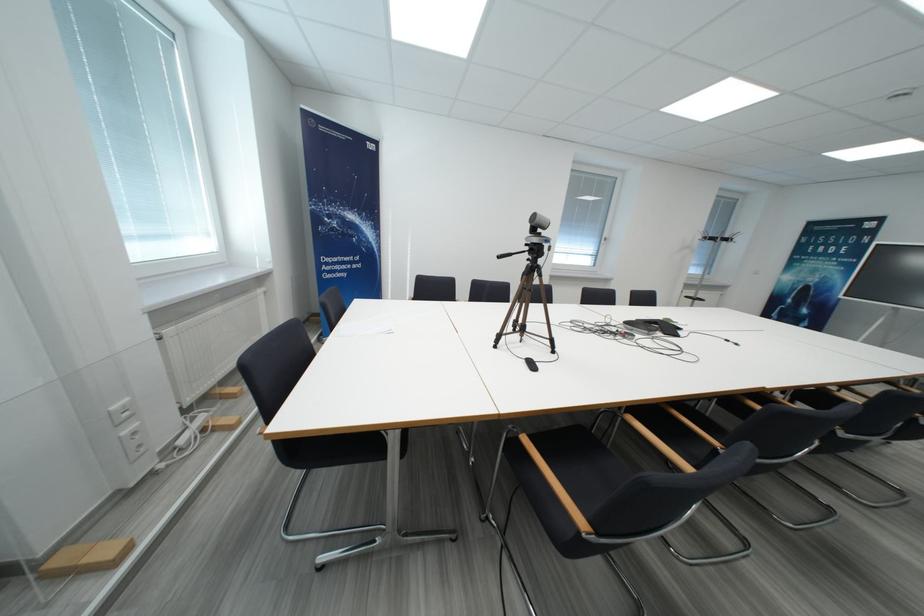
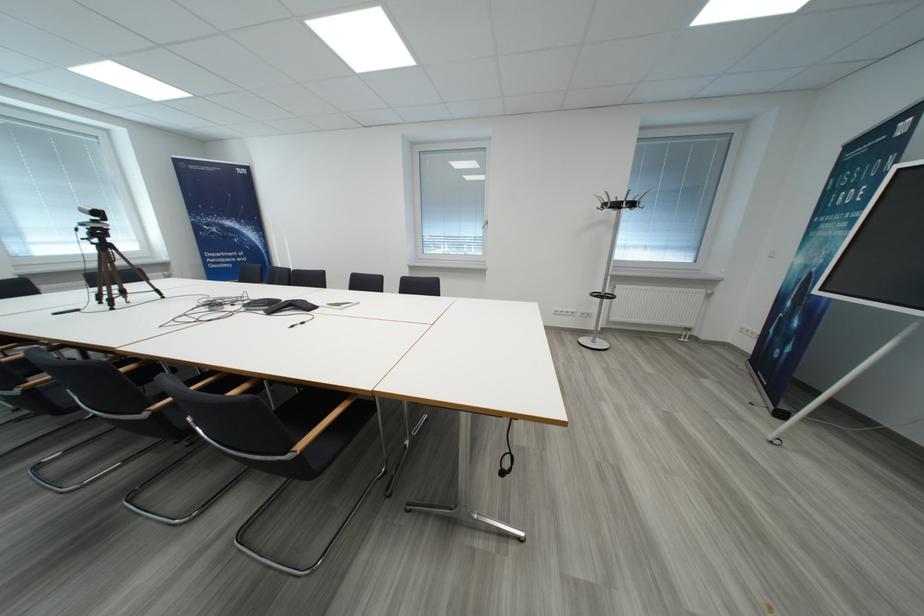
In the second image, find the point that corresponds to the point at 796,281 in the first image.

(807, 264)